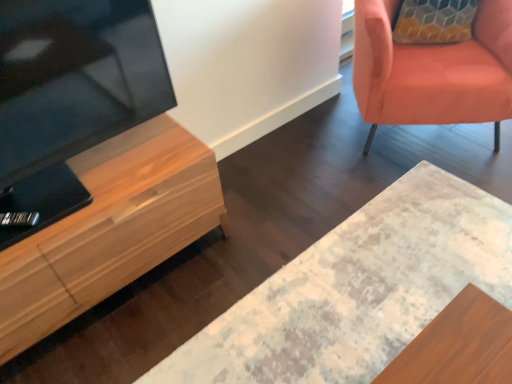
Image resolution: width=512 pixels, height=384 pixels. Identify the location of vacant space to the left of matte orange chair at upper right. (292, 167).